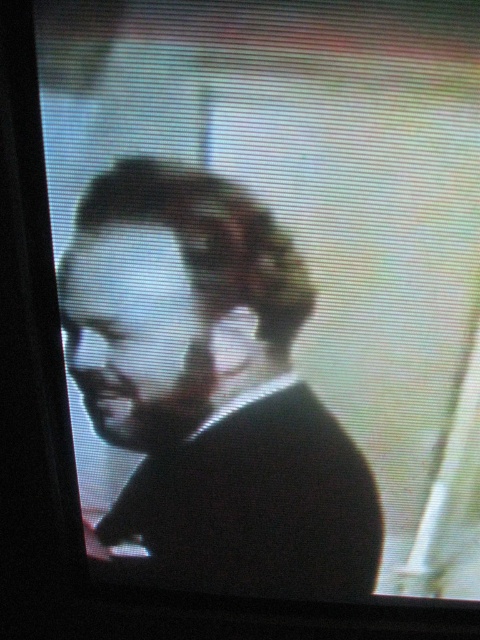
Question: Is the position of black matte suit at center less distant than that of matte black face at center?

Choices:
 (A) no
 (B) yes

Answer: (B)

Question: Which of the following is the closest to the observer?

Choices:
 (A) matte black face at center
 (B) black matte suit at center

Answer: (B)

Question: Can you confirm if black matte suit at center is positioned above matte black face at center?

Choices:
 (A) yes
 (B) no

Answer: (B)

Question: From the image, what is the correct spatial relationship of black matte suit at center in relation to matte black face at center?

Choices:
 (A) left
 (B) right

Answer: (B)